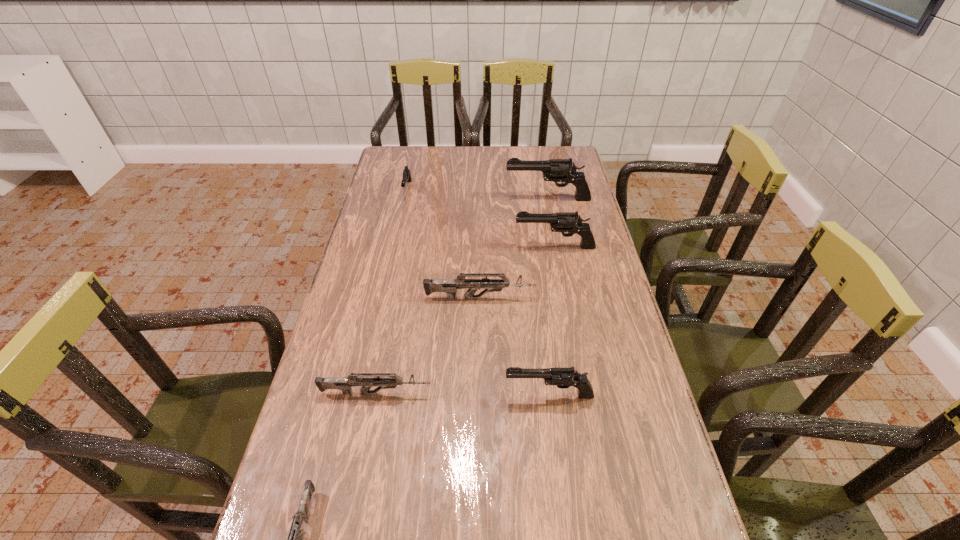
Find the location of a particular element. The width and height of the screenshot is (960, 540). the tallest gun is located at coordinates (557, 170).

You are a GUI agent. You are given a task and a screenshot of the screen. Output one action in this format:
    pyautogui.click(x=<x>, y=<y>)
    Task: Click on the biggest black gun
    This screenshot has width=960, height=540.
    Given the screenshot: What is the action you would take?
    pyautogui.click(x=557, y=170)

The width and height of the screenshot is (960, 540). Identify the location of the third farthest object. (568, 222).

In order to click on the fifth nearest gun in this screenshot , I will do `click(568, 222)`.

Locate an element on the screen. The image size is (960, 540). the nearest black gun is located at coordinates (563, 378).

This screenshot has height=540, width=960. I want to click on the farthest grey gun, so click(449, 286).

I want to click on the fourth farthest gun, so click(449, 286).

This screenshot has height=540, width=960. Find the location of `the smallest black gun`. the smallest black gun is located at coordinates (407, 177).

I want to click on the second nearest grey gun, so click(x=366, y=380).

Where is `free space located at the end of the barrel of the biggest black gun`? The width and height of the screenshot is (960, 540). free space located at the end of the barrel of the biggest black gun is located at coordinates (413, 199).